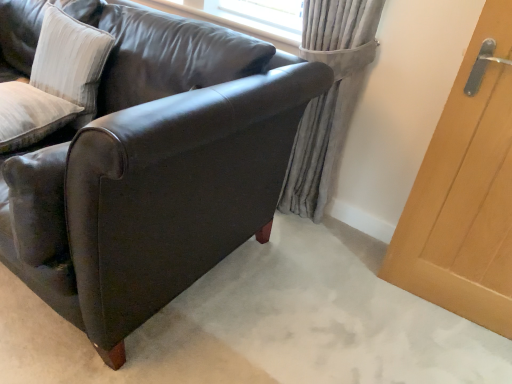
Question: Is white textured pillow at upper left, which ranks as the 1th pillow in bottom-to-top order, wider than white textured cushion at upper left, the 1th pillow from the top?

Choices:
 (A) yes
 (B) no

Answer: (A)

Question: Considering the relative sizes of white textured pillow at upper left, which ranks as the 1th pillow in bottom-to-top order, and white textured cushion at upper left, the 1th pillow from the top, in the image provided, is white textured pillow at upper left, which ranks as the 1th pillow in bottom-to-top order, smaller than white textured cushion at upper left, the 1th pillow from the top,?

Choices:
 (A) yes
 (B) no

Answer: (A)

Question: Is white textured pillow at upper left, the 2th pillow viewed from the top, next to white textured cushion at upper left, the 2th pillow in the bottom-to-top sequence?

Choices:
 (A) no
 (B) yes

Answer: (A)

Question: Is white textured pillow at upper left, which ranks as the 1th pillow in bottom-to-top order, bigger than white textured cushion at upper left, the 1th pillow from the top?

Choices:
 (A) yes
 (B) no

Answer: (B)

Question: Is white textured pillow at upper left, which ranks as the 1th pillow in bottom-to-top order, oriented away from white textured cushion at upper left, the 1th pillow from the top?

Choices:
 (A) no
 (B) yes

Answer: (B)

Question: Is white textured pillow at upper left, which ranks as the 1th pillow in bottom-to-top order, outside of white textured cushion at upper left, the 2th pillow in the bottom-to-top sequence?

Choices:
 (A) yes
 (B) no

Answer: (A)

Question: Does gray fabric curtain at upper right lie in front of light brown wood door at right?

Choices:
 (A) no
 (B) yes

Answer: (A)

Question: Is gray fabric curtain at upper right located outside light brown wood door at right?

Choices:
 (A) yes
 (B) no

Answer: (A)

Question: Is gray fabric curtain at upper right positioned behind light brown wood door at right?

Choices:
 (A) yes
 (B) no

Answer: (A)

Question: Is gray fabric curtain at upper right facing away from light brown wood door at right?

Choices:
 (A) no
 (B) yes

Answer: (A)

Question: Does gray fabric curtain at upper right appear on the right side of light brown wood door at right?

Choices:
 (A) no
 (B) yes

Answer: (A)

Question: Considering the relative sizes of gray fabric curtain at upper right and light brown wood door at right in the image provided, is gray fabric curtain at upper right taller than light brown wood door at right?

Choices:
 (A) no
 (B) yes

Answer: (A)

Question: Does white textured cushion at upper left, the 2th pillow in the bottom-to-top sequence, come behind gray fabric curtain at upper right?

Choices:
 (A) yes
 (B) no

Answer: (B)